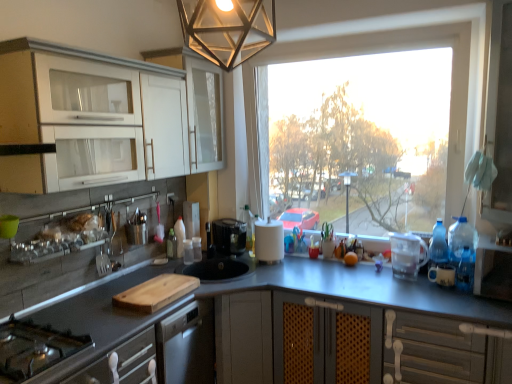
Find the location of `free space in front of blue translucent bottle at right, which appears as the 4th bottle when viewed from the back`. free space in front of blue translucent bottle at right, which appears as the 4th bottle when viewed from the back is located at coordinates (468, 305).